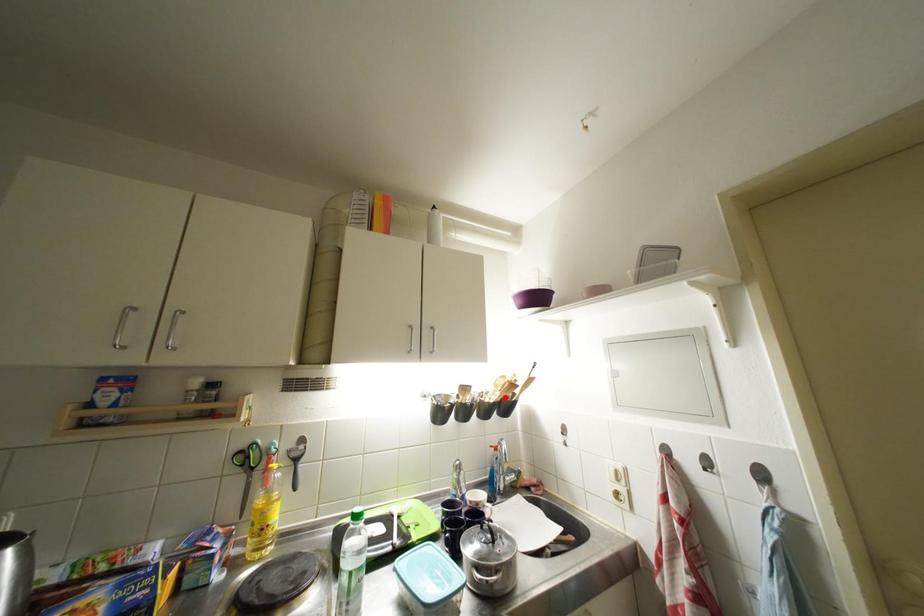
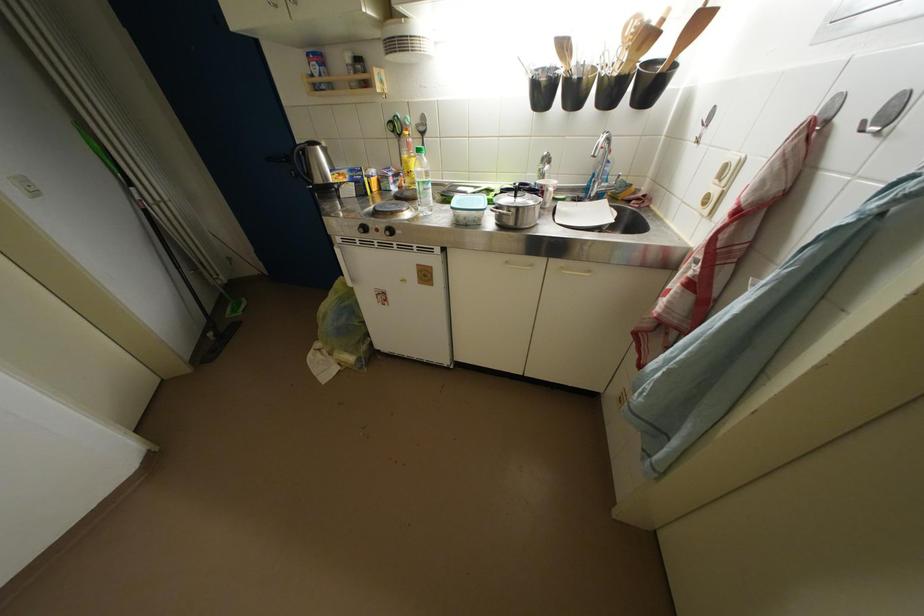
Where in the second image is the point corresponding to the highlighted location from the first image?

(631, 60)